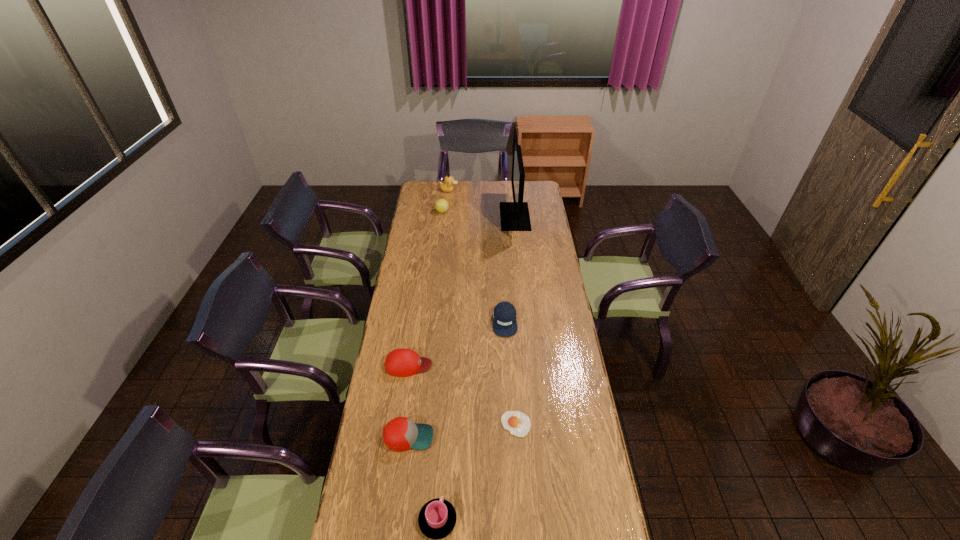
This screenshot has width=960, height=540. Identify the location of duckling at the left edge. (447, 186).

Image resolution: width=960 pixels, height=540 pixels. I want to click on tennis ball present at the left edge, so click(x=441, y=205).

This screenshot has width=960, height=540. What are the coordinates of `object situated at the right edge` in the screenshot? It's located at (514, 216).

Identify the location of object that is at the far left corner. This screenshot has width=960, height=540. (447, 186).

Image resolution: width=960 pixels, height=540 pixels. What are the coordinates of `object that is positioned at the far right corner` in the screenshot? It's located at (514, 216).

Locate an element on the screen. vacant space at the far edge of the desktop is located at coordinates pos(492,181).

Locate an element on the screen. The image size is (960, 540). free spot at the left edge of the desktop is located at coordinates (358, 470).

Locate an element on the screen. This screenshot has height=540, width=960. vacant space at the right edge of the desktop is located at coordinates (554, 249).

Locate an element on the screen. Image resolution: width=960 pixels, height=540 pixels. vacant space at the far left corner is located at coordinates (425, 193).

What are the coordinates of `vacant space at the far right corner of the desktop` in the screenshot? It's located at (540, 198).